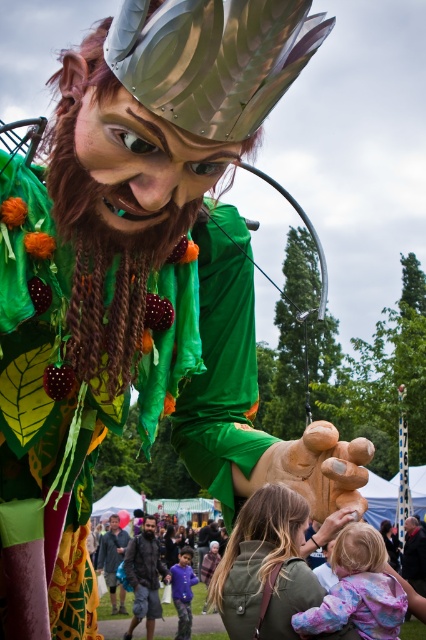
You are a photographer standing in the crowd at the event. You want to capture a photo of the forest spirit figure. The green fabric jacket at lower center is blocking your view. Can you estimate the jacket is positioned to the left or right of the center of the image?

The green fabric jacket at lower center is located at point 0.886 on the x coordinate, which is to the right of the center of the image.

You are a costume designer preparing to modify the green fabric jacket at lower center and the dark gray fabric jacket at lower center for a performance. Which jacket has a smaller width that might require less fabric for adjustments?

The green fabric jacket at lower center has a smaller width than the dark gray fabric jacket at lower center, so it requires less fabric for adjustments.